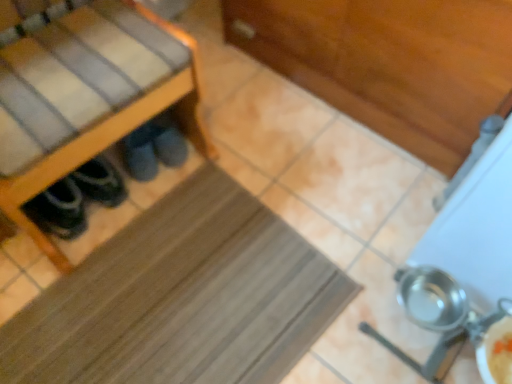
Question: From a real-world perspective, is dark gray suede slippers at lower left under metallic silver pot at lower right?

Choices:
 (A) no
 (B) yes

Answer: (B)

Question: Are dark gray suede slippers at lower left and metallic silver pot at lower right making contact?

Choices:
 (A) yes
 (B) no

Answer: (B)

Question: From a real-world perspective, is dark gray suede slippers at lower left on metallic silver pot at lower right?

Choices:
 (A) yes
 (B) no

Answer: (B)

Question: Is dark gray suede slippers at lower left shorter than metallic silver pot at lower right?

Choices:
 (A) yes
 (B) no

Answer: (A)

Question: Can you confirm if dark gray suede slippers at lower left is positioned to the right of metallic silver pot at lower right?

Choices:
 (A) yes
 (B) no

Answer: (B)

Question: From the image's perspective, relative to metallic silver pot at lower right, is wooden shoe rack at left above or below?

Choices:
 (A) below
 (B) above

Answer: (B)

Question: In terms of width, does wooden shoe rack at left look wider or thinner when compared to metallic silver pot at lower right?

Choices:
 (A) thin
 (B) wide

Answer: (B)

Question: Is wooden shoe rack at left inside the boundaries of metallic silver pot at lower right, or outside?

Choices:
 (A) inside
 (B) outside

Answer: (B)

Question: Visually, is wooden shoe rack at left positioned to the left or to the right of metallic silver pot at lower right?

Choices:
 (A) left
 (B) right

Answer: (A)

Question: Looking at the image, does dark gray suede slippers at lower left seem bigger or smaller compared to wooden shoe rack at left?

Choices:
 (A) big
 (B) small

Answer: (B)

Question: From the image's perspective, is dark gray suede slippers at lower left above or below wooden shoe rack at left?

Choices:
 (A) below
 (B) above

Answer: (A)

Question: Is dark gray suede slippers at lower left inside or outside of wooden shoe rack at left?

Choices:
 (A) outside
 (B) inside

Answer: (B)

Question: In terms of width, does dark gray suede slippers at lower left look wider or thinner when compared to wooden shoe rack at left?

Choices:
 (A) thin
 (B) wide

Answer: (A)

Question: Is wooden shoe rack at left inside or outside of brown rubber mat at center?

Choices:
 (A) outside
 (B) inside

Answer: (A)

Question: Looking at their shapes, would you say wooden shoe rack at left is wider or thinner than brown rubber mat at center?

Choices:
 (A) wide
 (B) thin

Answer: (B)